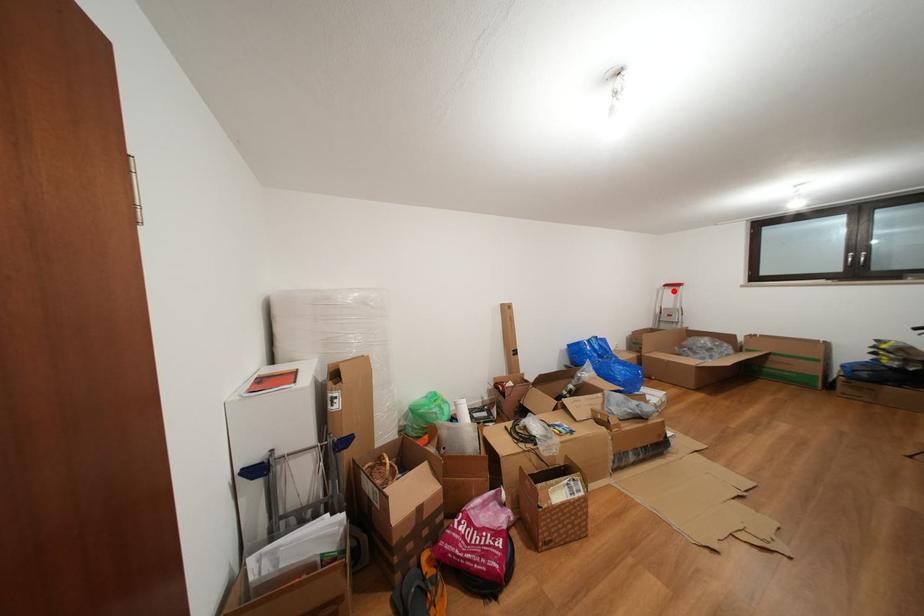
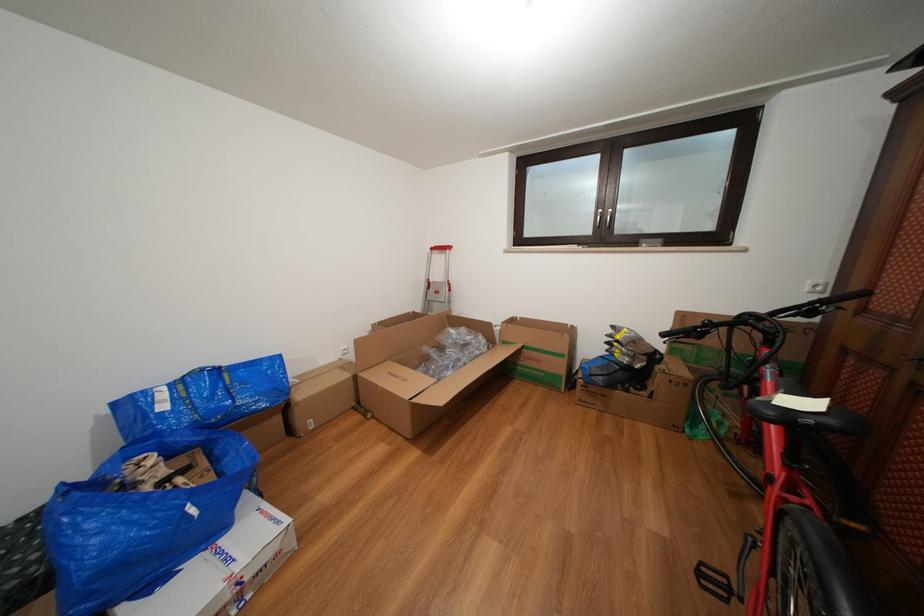
Where in the second image is the point corresponding to the highlighted location from the first image?

(441, 254)